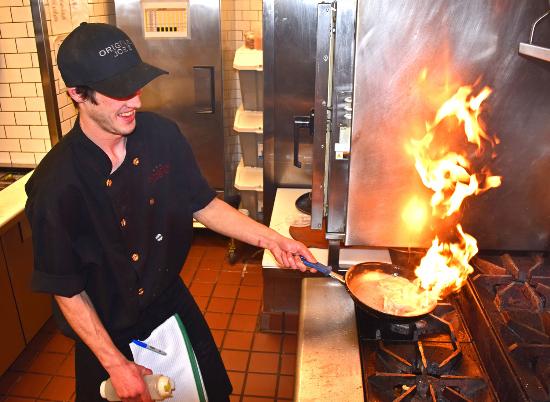
Where is `metal door`? metal door is located at coordinates (181, 77).